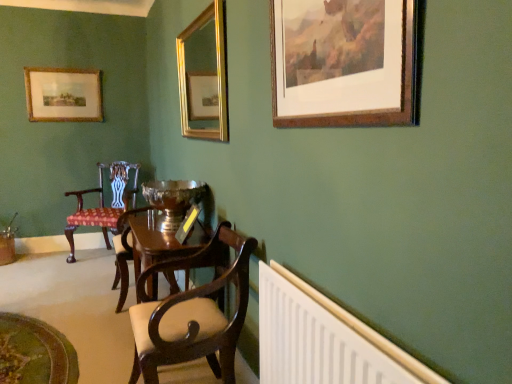
The width and height of the screenshot is (512, 384). What are the coordinates of `vacant area that lies in front of polka dot fabric chair at left, which is the first chair from left to right` in the screenshot? It's located at (74, 276).